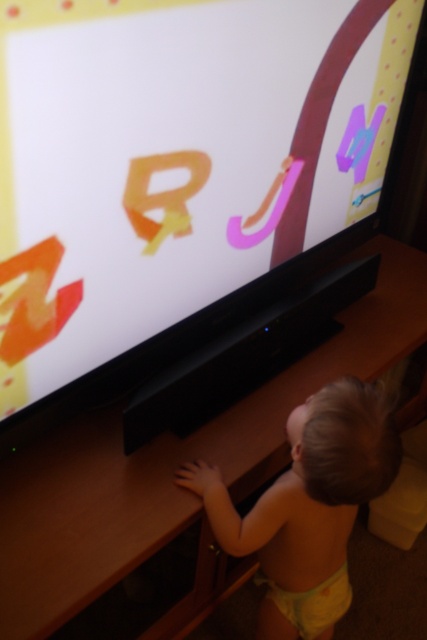
Question: Can you confirm if black plastic soundbar at center is positioned to the right of yellow fabric diaper at lower center?

Choices:
 (A) no
 (B) yes

Answer: (A)

Question: Considering the relative positions of blonde hair toddler at lower center and yellow fabric diaper at lower center in the image provided, where is blonde hair toddler at lower center located with respect to yellow fabric diaper at lower center?

Choices:
 (A) below
 (B) above

Answer: (B)

Question: Can you confirm if blonde hair toddler at lower center is positioned below yellow fabric diaper at lower center?

Choices:
 (A) yes
 (B) no

Answer: (B)

Question: Which object is farther from the camera taking this photo?

Choices:
 (A) purple matte letter m at upper right
 (B) blonde hair toddler at lower center
 (C) pink matte letter j at center
 (D) matte plastic letters at upper center

Answer: (A)

Question: Which point appears closest to the camera in this image?

Choices:
 (A) [201, 152]
 (B) [56, 337]

Answer: (B)

Question: Which point appears closest to the camera in this image?

Choices:
 (A) (231, 216)
 (B) (274, 596)
 (C) (12, 307)
 (D) (389, 458)

Answer: (C)